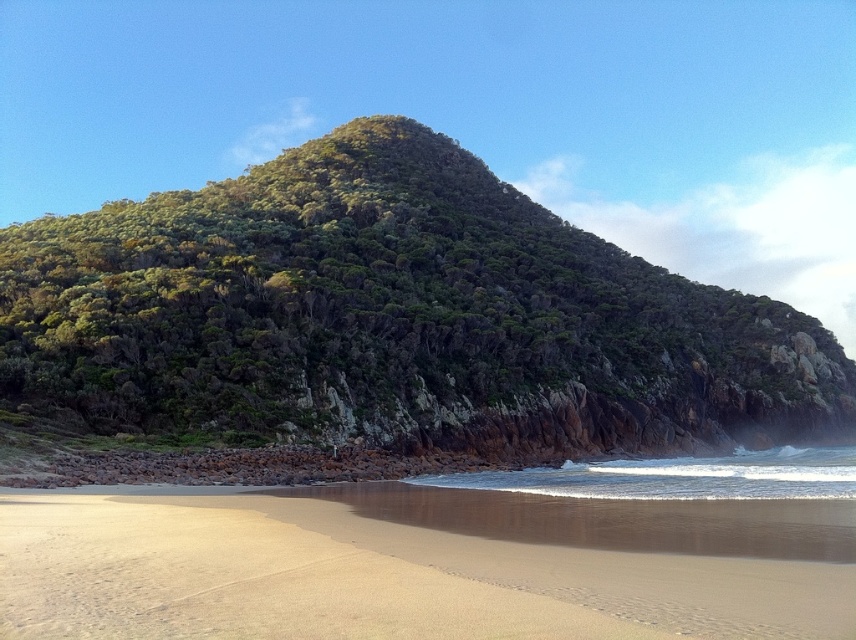
You are planning to build a small cabin on the property. Which location would you choose between the green rocky cliff at center and the sandy beach at lower center, and why?

You should choose the sandy beach at lower center because the green rocky cliff at center is bigger and may be less stable for construction. The sandy beach at lower center is smaller and more level, making it a safer and more practical location for building a cabin.